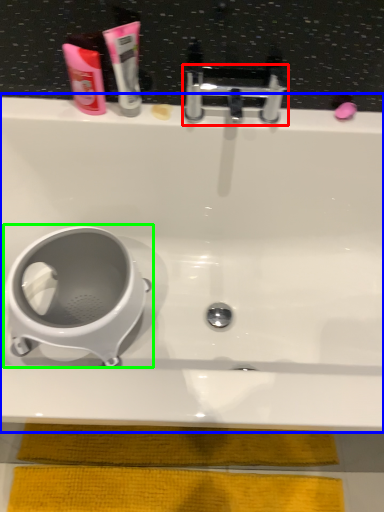
Question: Which is farther away from tap (highlighted by a red box)? bathtub (highlighted by a blue box) or toilet (highlighted by a green box)?

Choices:
 (A) bathtub
 (B) toilet

Answer: (B)